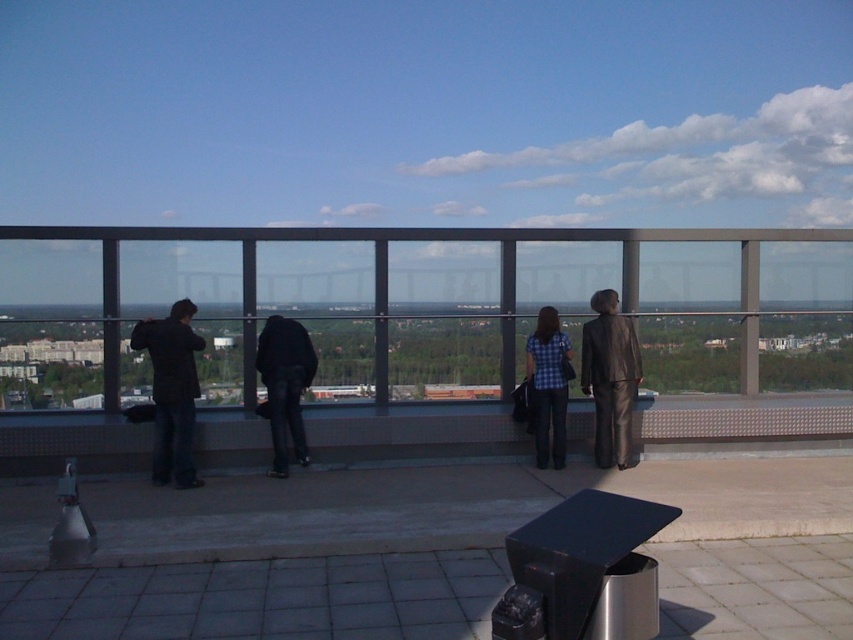
Does black matte jacket at left appear on the right side of blue plaid shirt at center?

No, black matte jacket at left is not to the right of blue plaid shirt at center.

Does black matte jacket at left have a greater height compared to blue plaid shirt at center?

Yes, black matte jacket at left is taller than blue plaid shirt at center.

Between point (161, 449) and point (556, 444), which one is positioned in front?

Point (161, 449)

Identify the location of black matte jacket at left. (172, 392).

Does black matte jacket at left appear on the right side of shiny brown suit at right?

Incorrect, black matte jacket at left is not on the right side of shiny brown suit at right.

Measure the distance between point (x=175, y=438) and camera.

The distance of point (x=175, y=438) from camera is 8.08 meters.

Is point (138, 323) farther from viewer compared to point (630, 428)?

No, (138, 323) is closer to viewer.

Find the location of `black matte jacket at left`. black matte jacket at left is located at coordinates (172, 392).

Which is more to the right, black matte pants at center or blue plaid shirt at center?

blue plaid shirt at center is more to the right.

Is point (279, 436) positioned behind point (532, 369)?

No, (279, 436) is in front of (532, 369).

Is point (309, 372) closer to camera compared to point (531, 333)?

Yes, it is in front of point (531, 333).

The height and width of the screenshot is (640, 853). Find the location of `black matte pants at center`. black matte pants at center is located at coordinates (285, 385).